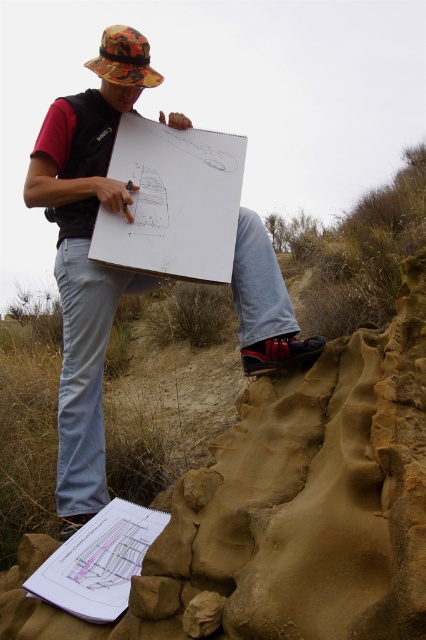
Who is positioned more to the left, camouflage hat at upper left or camouflage fabric hat at upper center?

camouflage fabric hat at upper center is more to the left.

From the picture: Is camouflage hat at upper left shorter than camouflage fabric hat at upper center?

Correct, camouflage hat at upper left is not as tall as camouflage fabric hat at upper center.

Does point (37, 148) lie in front of point (118, 29)?

No.

Where is `camouflage hat at upper left`? camouflage hat at upper left is located at coordinates (83, 278).